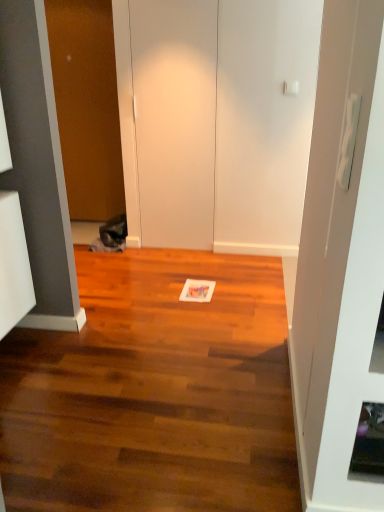
Find the location of a particular element. This screenshot has height=512, width=384. vacant area that is in front of white matte door at center, marked as the 1th door in a right-to-left arrangement is located at coordinates (176, 263).